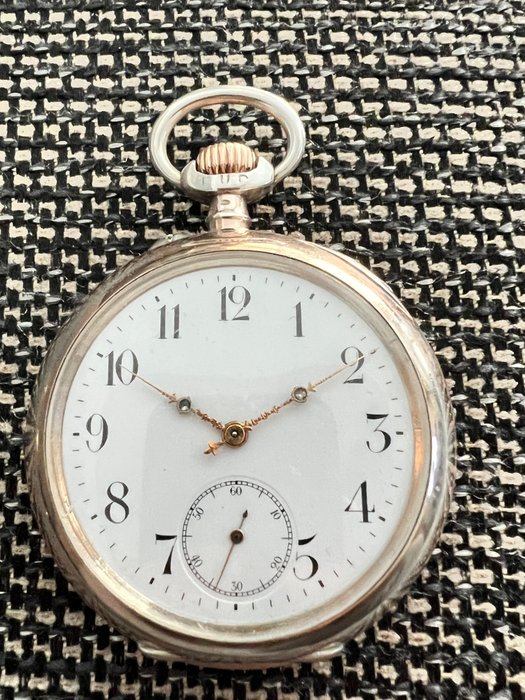
You are a GUI agent. You are given a task and a screenshot of the screen. Output one action in this format:
    pyautogui.click(x=<x>, y=<y>)
    Task: Click on the hands of the clock
    
    Given the screenshot: What is the action you would take?
    pyautogui.click(x=201, y=416), pyautogui.click(x=265, y=414)